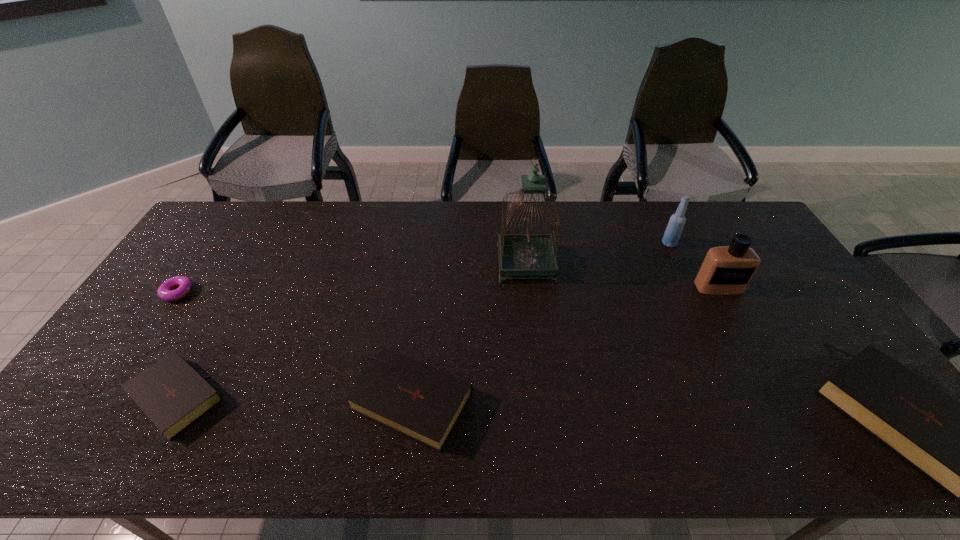
Where is `doughnut at the left edge`? Image resolution: width=960 pixels, height=540 pixels. doughnut at the left edge is located at coordinates (165, 291).

Locate an element on the screen. object present at the near left corner is located at coordinates (173, 395).

Where is `vacant space at the far edge of the desktop`? The height and width of the screenshot is (540, 960). vacant space at the far edge of the desktop is located at coordinates (302, 238).

Identify the location of vacant space at the near edge of the desktop. Image resolution: width=960 pixels, height=540 pixels. (701, 397).

You are a GUI agent. You are given a task and a screenshot of the screen. Output one action in this format:
    pyautogui.click(x=<x>, y=<y>)
    Task: Click on the vacant area at the left edge
    This screenshot has height=540, width=960.
    Given the screenshot: What is the action you would take?
    click(x=230, y=250)

The image size is (960, 540). In order to click on free space at the right edge of the desktop in this screenshot , I will do `click(798, 300)`.

I want to click on vacant region between the second Bible from right to left and the shortest Bible, so click(296, 397).

Image resolution: width=960 pixels, height=540 pixels. I want to click on vacant space that's between the leftmost object and the perfume, so click(448, 290).

Where is `free space between the perfume and the shortest object`? free space between the perfume and the shortest object is located at coordinates (448, 290).

Locate an element on the screen. The height and width of the screenshot is (540, 960). vacant area between the bottle and the second tallest Bible is located at coordinates (540, 322).